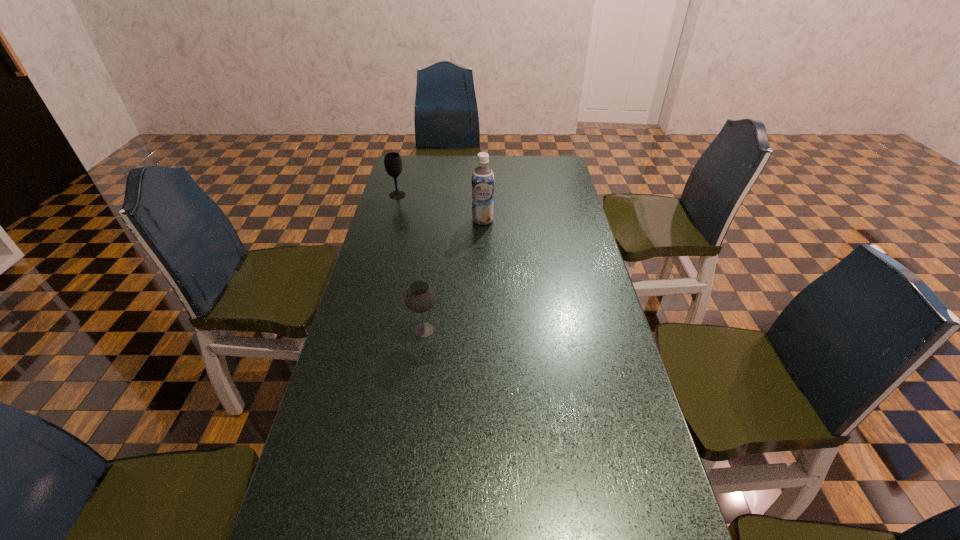
Identify the location of blank space at the far edge of the desktop. (443, 162).

Locate an element on the screen. free region at the left edge of the desktop is located at coordinates (318, 491).

This screenshot has width=960, height=540. What are the coordinates of `free space at the right edge of the desktop` in the screenshot? It's located at (639, 497).

This screenshot has width=960, height=540. I want to click on blank space at the far left corner, so click(411, 162).

Locate an element on the screen. The height and width of the screenshot is (540, 960). free spot between the soya milk and the farther wineglass is located at coordinates (440, 207).

This screenshot has width=960, height=540. What are the coordinates of `free spot between the second nearest object and the right wineglass` in the screenshot? It's located at (453, 275).

At what (x,y) coordinates should I click in order to perform the action: click on vacant space that's between the farther wineglass and the nearest object. Please return your answer as a coordinate pair (x, y). This screenshot has height=540, width=960. Looking at the image, I should click on (411, 262).

Image resolution: width=960 pixels, height=540 pixels. In order to click on free spot between the tallest object and the right wineglass in this screenshot , I will do `click(453, 275)`.

The width and height of the screenshot is (960, 540). What are the coordinates of `unoccupied area between the second object from right to left and the farther wineglass` in the screenshot? It's located at (411, 262).

Locate an element on the screen. This screenshot has height=540, width=960. free space between the rightmost object and the leftmost object is located at coordinates (440, 207).